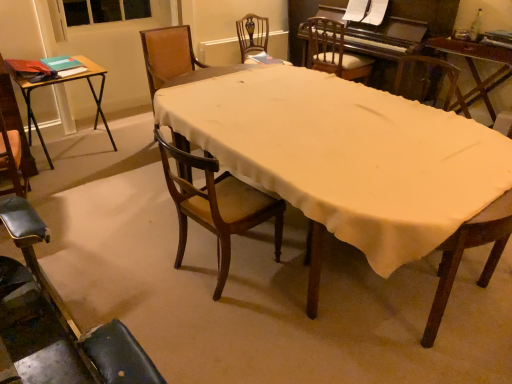
You are a GUI agent. You are given a task and a screenshot of the screen. Output one action in this format:
    pyautogui.click(x=<x>, y=<y>)
    Task: Click on the free space that is to the left of wooden chair at center, placed as the 3th chair when sorted from back to front
    The image size is (512, 384).
    Given the screenshot: What is the action you would take?
    pyautogui.click(x=131, y=147)